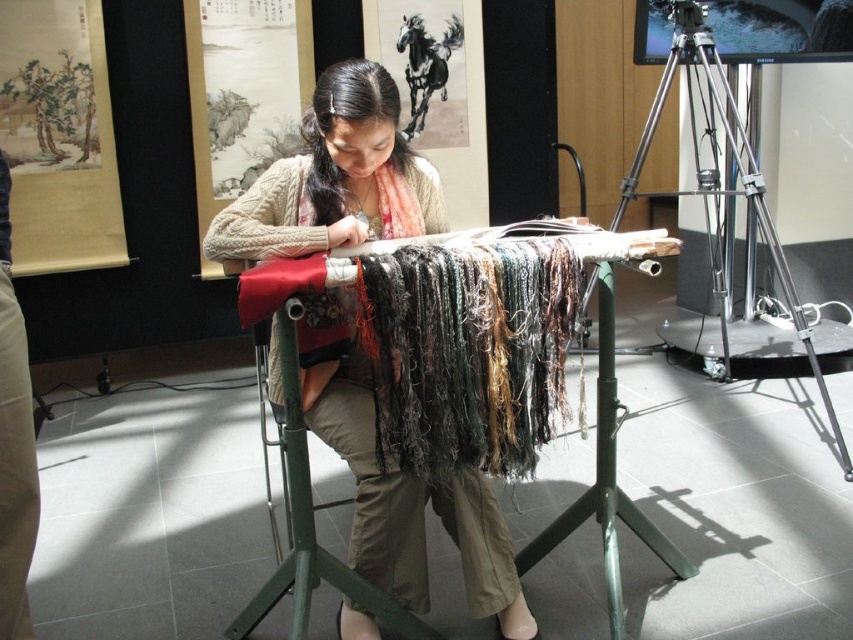
Question: Is metallic green table at center to the left of metallic tripod at right from the viewer's perspective?

Choices:
 (A) yes
 (B) no

Answer: (A)

Question: Which object appears farthest from the camera in this image?

Choices:
 (A) metallic green table at center
 (B) metallic tripod at right

Answer: (B)

Question: Observing the image, what is the correct spatial positioning of metallic green table at center in reference to metallic tripod at right?

Choices:
 (A) below
 (B) above

Answer: (A)

Question: Among these objects, which one is farthest from the camera?

Choices:
 (A) metallic green table at center
 (B) metallic tripod at right

Answer: (B)

Question: Is metallic green table at center above metallic tripod at right?

Choices:
 (A) yes
 (B) no

Answer: (B)